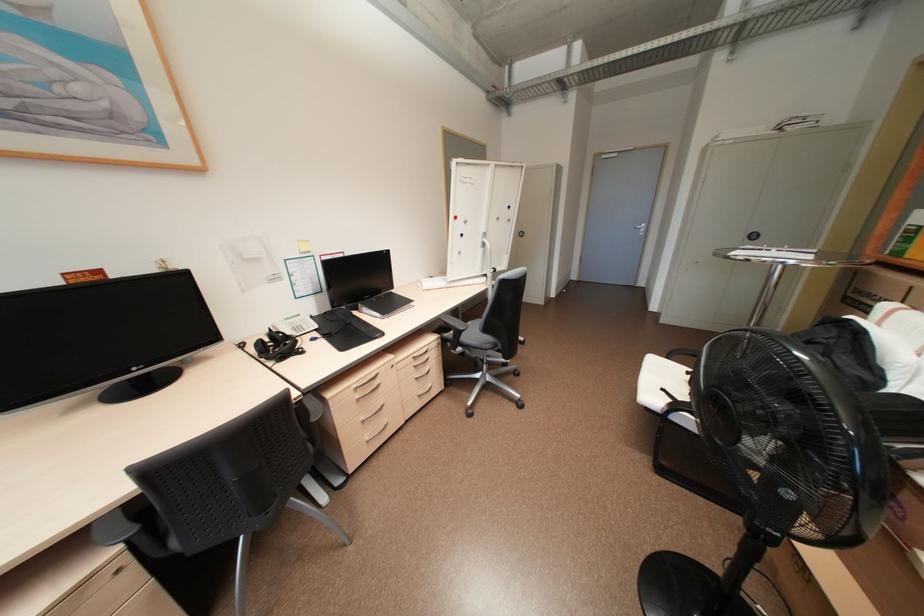
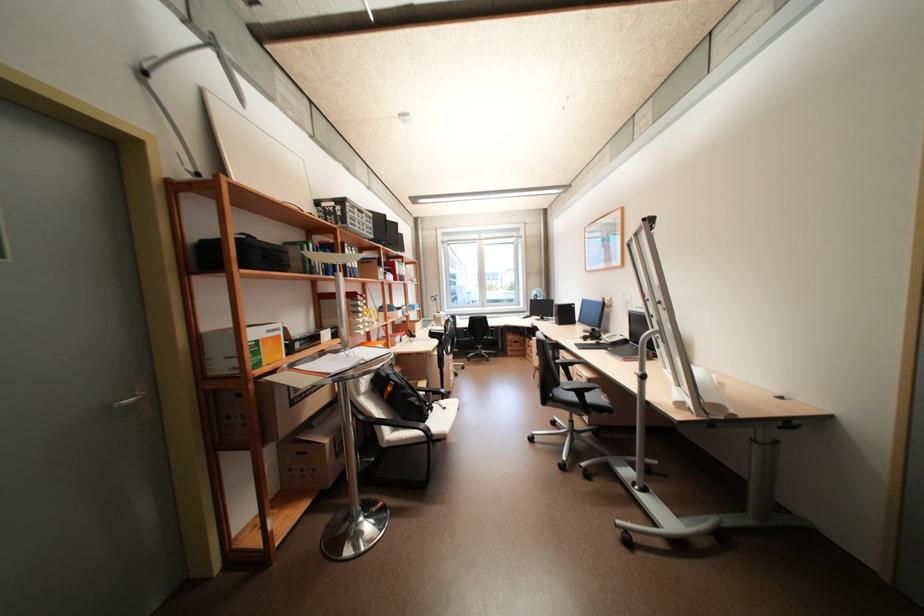
Locate, in the second image, the point that corresponds to pixel 319 339 in the first image.

(603, 342)